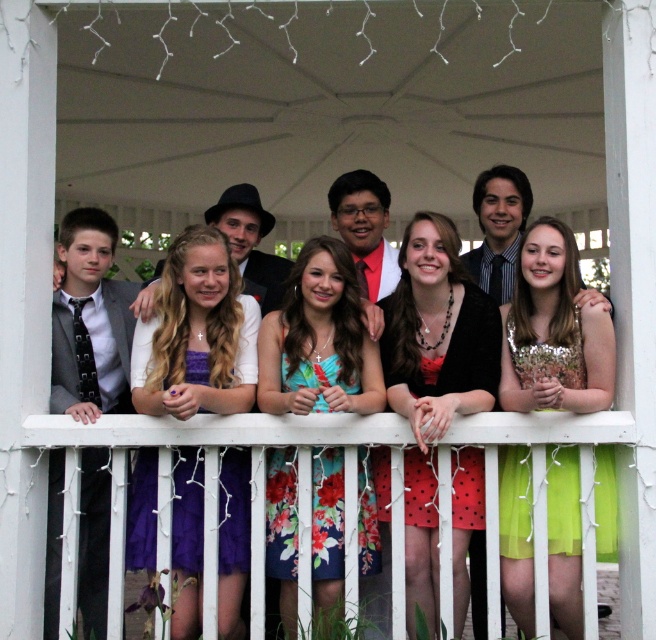
Question: Is purple satin dress at center above floral dress at center?

Choices:
 (A) yes
 (B) no

Answer: (A)

Question: Among these points, which one is nearest to the camera?

Choices:
 (A) (574, 557)
 (B) (462, 561)
 (C) (182, 358)
 (D) (323, 396)

Answer: (D)

Question: Can you confirm if purple satin dress at center is smaller than green sequined dress at center?

Choices:
 (A) no
 (B) yes

Answer: (A)

Question: Which of the following is the farthest from the observer?

Choices:
 (A) polka dot fabric dress at center
 (B) green sequined dress at center
 (C) purple satin dress at center
 (D) floral dress at center

Answer: (D)

Question: Which point appears closest to the camera in this image?

Choices:
 (A) (447, 305)
 (B) (318, 296)
 (C) (197, 584)

Answer: (C)

Question: Does purple satin dress at center have a greater width compared to floral dress at center?

Choices:
 (A) yes
 (B) no

Answer: (A)